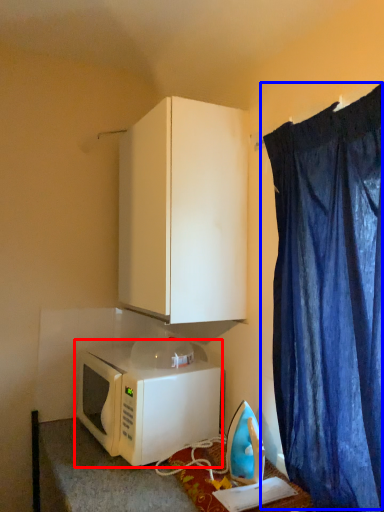
Question: Which point is further to the camera, microwave oven (highlighted by a red box) or curtain (highlighted by a blue box)?

Choices:
 (A) microwave oven
 (B) curtain

Answer: (A)